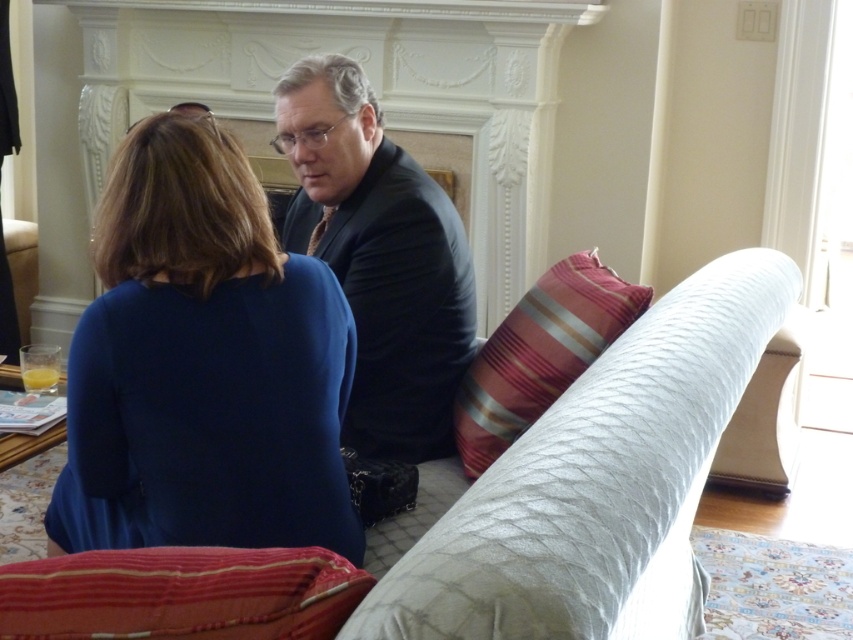
Question: Does matte black suit at center appear on the left side of red striped cushion at lower left?

Choices:
 (A) no
 (B) yes

Answer: (A)

Question: Considering the real-world distances, which object is closest to the white quilted couch at center?

Choices:
 (A) striped fabric pillow at center
 (B) matte black suit at center
 (C) navy blue fabric dress at center
 (D) red striped cushion at lower left

Answer: (D)

Question: Which point is closer to the camera?

Choices:
 (A) (589, 403)
 (B) (323, 218)
 (C) (547, 364)
 (D) (41, 592)

Answer: (D)

Question: Which object appears closest to the camera in this image?

Choices:
 (A) navy blue fabric dress at center
 (B) red striped cushion at lower left

Answer: (B)

Question: Can you confirm if matte black suit at center is thinner than striped fabric pillow at center?

Choices:
 (A) no
 (B) yes

Answer: (A)

Question: Does white quilted couch at center appear on the right side of red striped cushion at lower left?

Choices:
 (A) no
 (B) yes

Answer: (B)